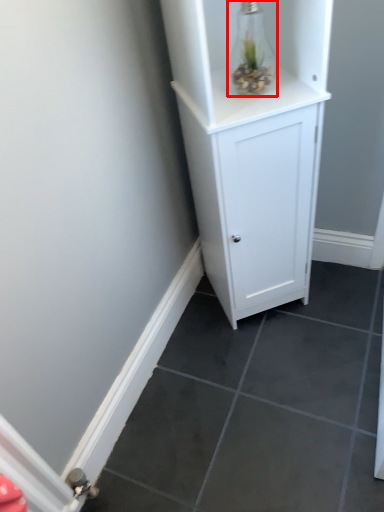
Question: In this image, where is glass vase (annotated by the red box) located relative to cupboard?

Choices:
 (A) left
 (B) right

Answer: (A)